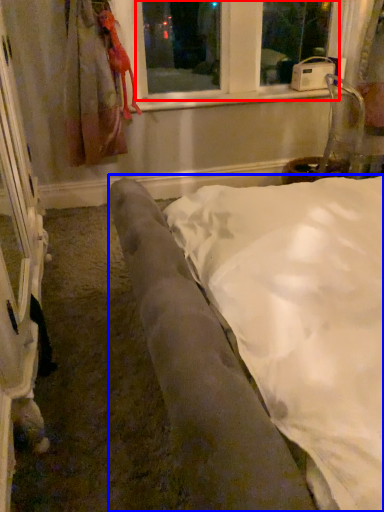
Question: Which of the following is the closest to the observer, bay window (highlighted by a red box) or furniture (highlighted by a blue box)?

Choices:
 (A) bay window
 (B) furniture

Answer: (B)